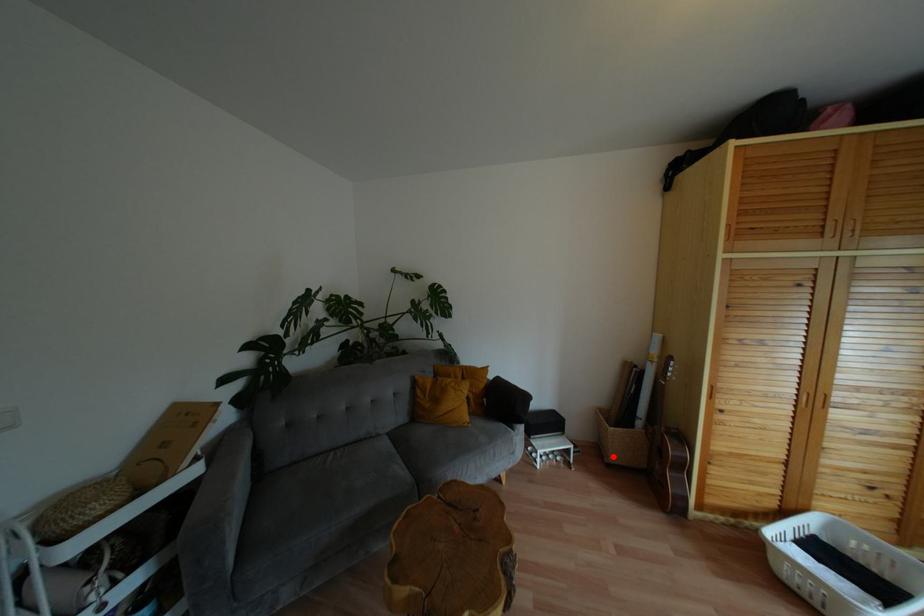
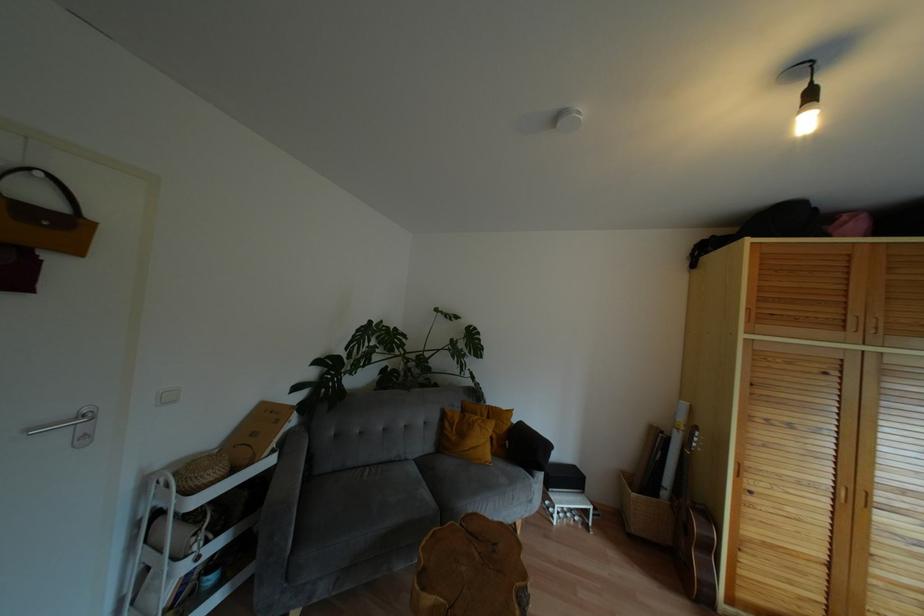
Where in the second image is the point corresponding to the highlighted location from the first image?

(636, 527)